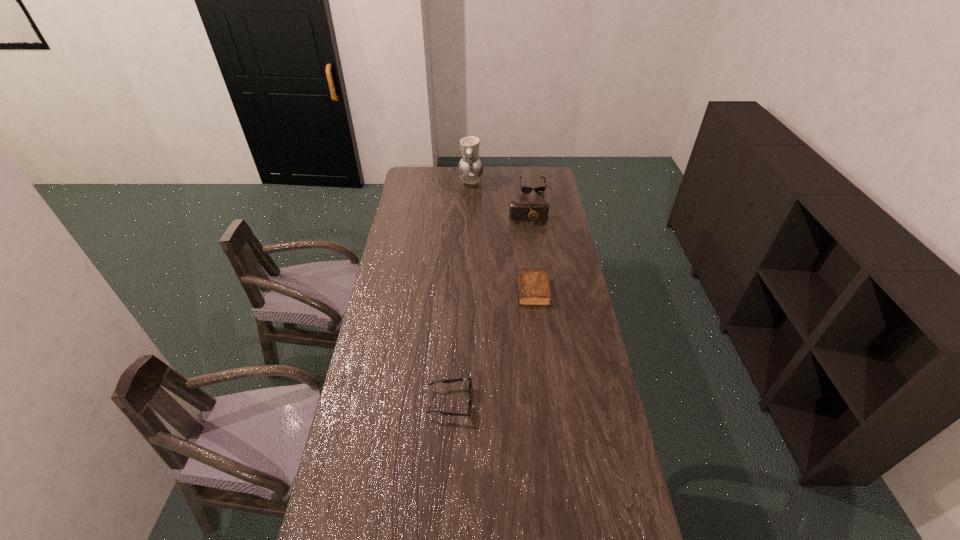
You are a GUI agent. You are given a task and a screenshot of the screen. Output one action in this format:
    pyautogui.click(x=<x>, y=<y>)
    Task: Click on the free area in between the second nearest object and the nearest object
    This screenshot has width=960, height=540.
    Given the screenshot: What is the action you would take?
    click(492, 347)

This screenshot has width=960, height=540. Identify the location of vacant area that lies between the diary and the farther sunglasses. (532, 239).

This screenshot has height=540, width=960. I want to click on vacant area that lies between the second nearest object and the farther sunglasses, so click(x=532, y=239).

Select which object appears as the third closest to the tallest object. Please provide its 2D coordinates. Your answer should be formatted as a tuple, i.e. [(x, y)], where the tuple contains the x and y coordinates of a point satisfying the conditions above.

[(533, 287)]

Where is `object that is the nearest to the third nearest object`? The width and height of the screenshot is (960, 540). object that is the nearest to the third nearest object is located at coordinates (524, 189).

The image size is (960, 540). What are the coordinates of `vacant space that satisfies the following two spatial constraints: 1. on the front-facing side of the third nearest object; 2. on the spine side of the fourth farthest object` in the screenshot? It's located at (539, 291).

Locate an element on the screen. free space in the image that satisfies the following two spatial constraints: 1. on the front-facing side of the right sunglasses; 2. on the front-facing side of the nearer sunglasses is located at coordinates (566, 402).

You are a GUI agent. You are given a task and a screenshot of the screen. Output one action in this format:
    pyautogui.click(x=<x>, y=<y>)
    Task: Click on the free location that satisfies the following two spatial constraints: 1. on the front-facing side of the camera; 2. on the front-facing side of the nearest object
    This screenshot has width=960, height=540.
    Given the screenshot: What is the action you would take?
    pyautogui.click(x=554, y=402)

Locate an element on the screen. The image size is (960, 540). vacant position in the image that satisfies the following two spatial constraints: 1. on the front-facing side of the farther sunglasses; 2. on the front-facing side of the left sunglasses is located at coordinates (566, 402).